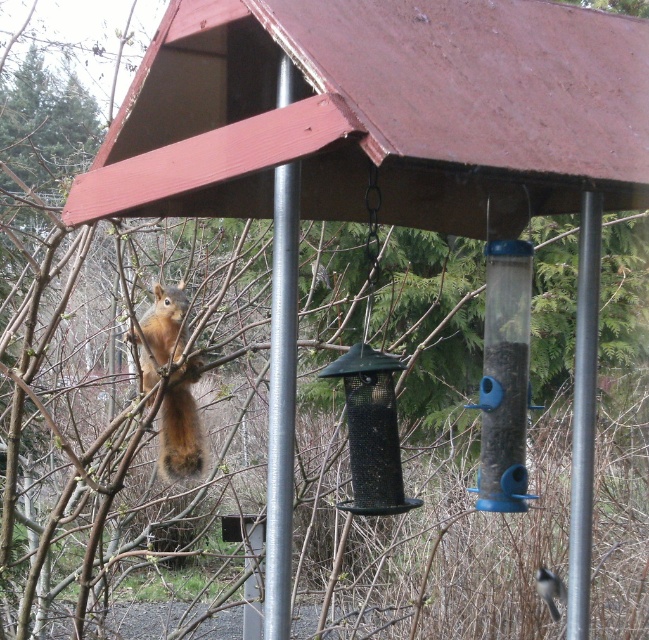
Does point (278, 586) lie behind point (576, 483)?

That is False.

Does point (289, 499) come in front of point (585, 541)?

Yes.

Where is `brushed metal pole at center`? This screenshot has width=649, height=640. brushed metal pole at center is located at coordinates (282, 401).

Where is `brushed metal pole at center`? brushed metal pole at center is located at coordinates (282, 401).

Is point (583, 520) farther from viewer compared to point (167, 312)?

No, it is in front of (167, 312).

Who is more distant from viewer, (576, 532) or (186, 371)?

The point (186, 371) is behind.

Who is more distant from viewer, (585, 628) or (178, 390)?

Positioned behind is point (178, 390).

At what (x,y) coordinates should I click in order to perform the action: click on metallic gray pole at center. Please return your answer as a coordinate pair (x, y). This screenshot has width=649, height=640. Looking at the image, I should click on (583, 417).

Is point (273, 376) positioned before point (165, 413)?

Yes.

Find the location of a particular element. The image size is (649, 640). brushed metal pole at center is located at coordinates (282, 401).